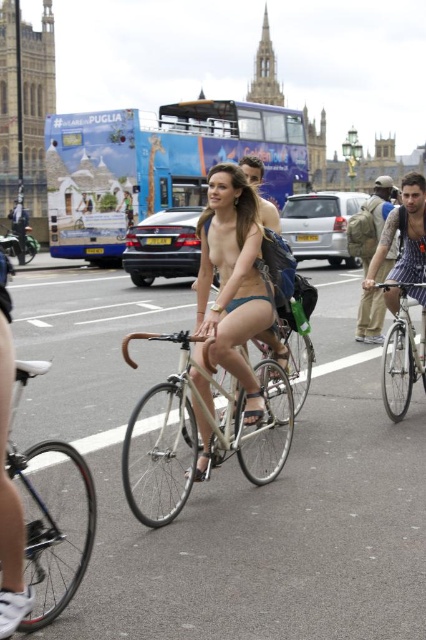
Between metallic silver bicycle at center and silver metallic bicycle at center, which one is positioned lower?

Positioned lower is silver metallic bicycle at center.

Can you confirm if metallic silver bicycle at center is positioned to the right of silver metallic bicycle at center?

Yes, metallic silver bicycle at center is to the right of silver metallic bicycle at center.

Find the location of `metallic silver bicycle at center`. metallic silver bicycle at center is located at coordinates (232, 481).

Find the location of a particular element. The height and width of the screenshot is (640, 426). metallic silver bicycle at center is located at coordinates (232, 481).

Describe the element at coordinates (235, 282) in the screenshot. I see `matte skin nude at center` at that location.

The width and height of the screenshot is (426, 640). Find the location of `matte skin nude at center`. matte skin nude at center is located at coordinates (235, 282).

Locate an element on the screen. This screenshot has height=640, width=426. matte skin nude at center is located at coordinates (235, 282).

Between silver metallic bicycle at center and stone spire at upper center, which one appears on the left side from the viewer's perspective?

silver metallic bicycle at center

Is silver metallic bicycle at center to the right of stone spire at upper center from the viewer's perspective?

Incorrect, silver metallic bicycle at center is not on the right side of stone spire at upper center.

At what (x,y) coordinates should I click in order to perform the action: click on silver metallic bicycle at center. Please return your answer as a coordinate pair (x, y). The width and height of the screenshot is (426, 640). Looking at the image, I should click on (209, 417).

Identify the location of silver metallic bicycle at center. The image size is (426, 640). (209, 417).